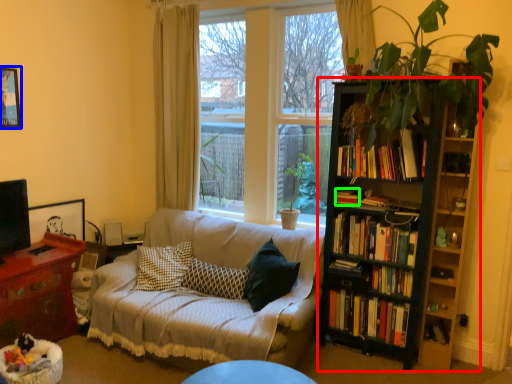
Question: Which object is positioned closest to bookcase (highlighted by a red box)? Select from picture frame (highlighted by a blue box) and book (highlighted by a green box).

Choices:
 (A) picture frame
 (B) book

Answer: (B)